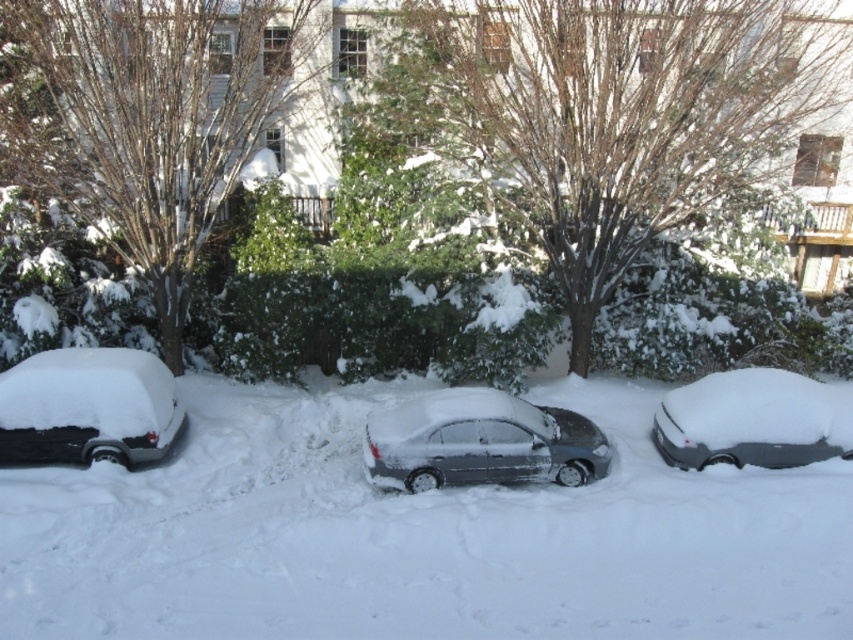
Question: Which object appears closest to the camera in this image?

Choices:
 (A) black matte car at left
 (B) snow-covered sedan at right
 (C) brown textured tree at center
 (D) snow-covered tree at upper left

Answer: (A)

Question: Is snow-covered tree at upper left behind black matte car at left?

Choices:
 (A) yes
 (B) no

Answer: (A)

Question: Can you confirm if sleek metallic sedan at center is thinner than black matte car at left?

Choices:
 (A) yes
 (B) no

Answer: (B)

Question: Which is farther from the sleek metallic sedan at center?

Choices:
 (A) snow-covered tree at upper left
 (B) black matte car at left
 (C) brown textured tree at center

Answer: (A)

Question: Which point appears closest to the camera in this image?

Choices:
 (A) (723, 444)
 (B) (466, 77)

Answer: (A)

Question: Does snow-covered tree at upper left appear on the left side of black matte car at left?

Choices:
 (A) no
 (B) yes

Answer: (B)